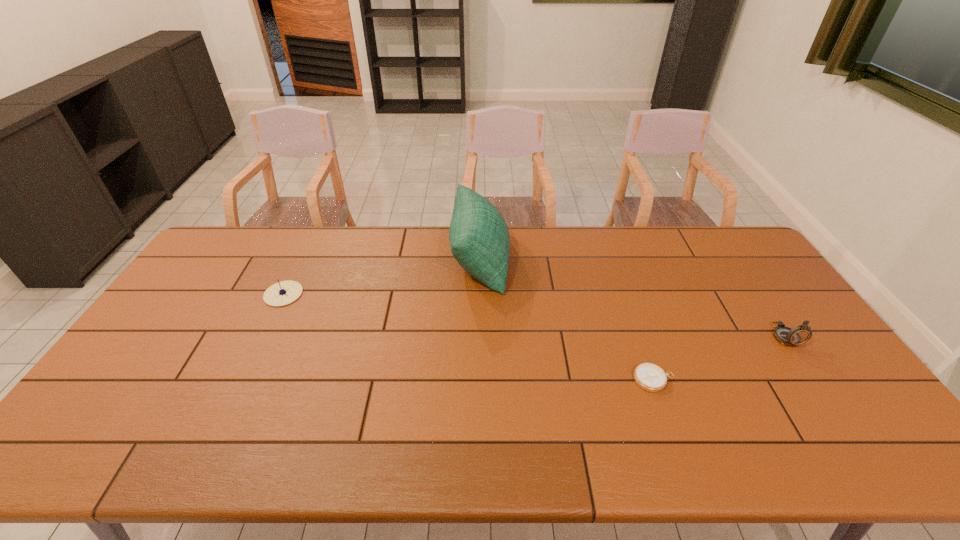
Where is `cushion`? The width and height of the screenshot is (960, 540). cushion is located at coordinates (479, 238).

The image size is (960, 540). I want to click on the tallest object, so click(479, 238).

You are a GUI agent. You are given a task and a screenshot of the screen. Output one action in this format:
    pyautogui.click(x=<x>, y=<y>)
    Task: Click on the second nearest compass
    This screenshot has height=540, width=960.
    Given the screenshot: What is the action you would take?
    pyautogui.click(x=800, y=334)

Find the location of `the tallest compass`. the tallest compass is located at coordinates (800, 334).

I want to click on the leftmost compass, so click(282, 293).

Locate an element on the screen. The height and width of the screenshot is (540, 960). the second shortest compass is located at coordinates (282, 293).

You are a GUI agent. You are given a task and a screenshot of the screen. Output one action in this format:
    pyautogui.click(x=<x>, y=<y>)
    Task: Click on the nearest compass
    The height and width of the screenshot is (540, 960).
    Given the screenshot: What is the action you would take?
    pyautogui.click(x=650, y=377)

This screenshot has width=960, height=540. In order to click on the nearest object in this screenshot , I will do `click(650, 377)`.

Image resolution: width=960 pixels, height=540 pixels. Find the location of `vacant space located 0.110m on the front-facing side of the tallest object`. vacant space located 0.110m on the front-facing side of the tallest object is located at coordinates (540, 261).

Locate an element on the screen. vacant space located 0.180m on the face of the rightmost compass is located at coordinates (832, 406).